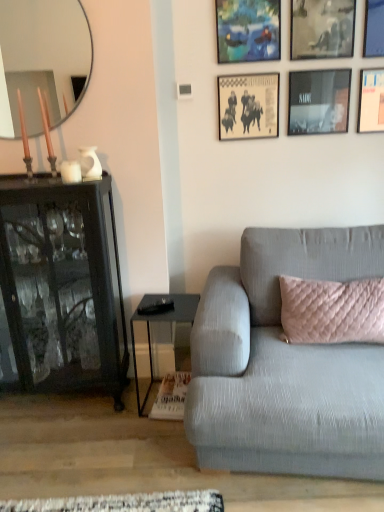
Where is `vacant space underneath black glass cabinet at left (from a real-world perspective)`? Image resolution: width=384 pixels, height=512 pixels. vacant space underneath black glass cabinet at left (from a real-world perspective) is located at coordinates (51, 402).